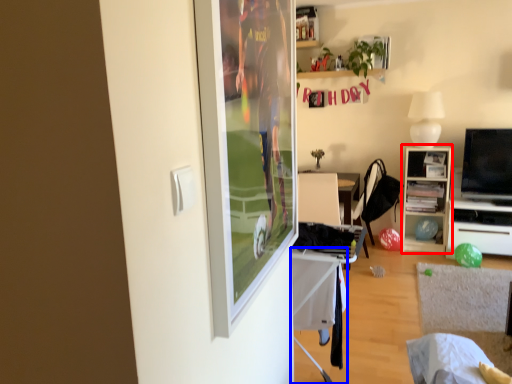
Question: Which point is closer to the camera, cabinetry (highlighted by a red box) or table (highlighted by a blue box)?

Choices:
 (A) cabinetry
 (B) table

Answer: (B)